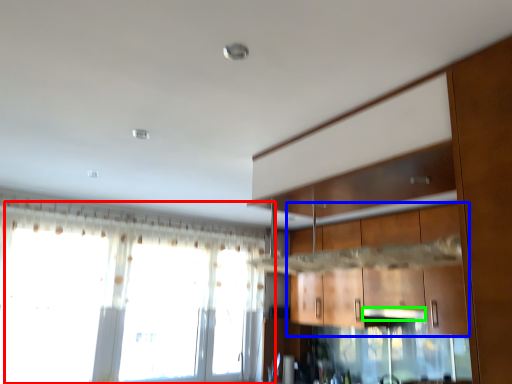
Question: Which object is positioned closest to window (highlighted by a red box)? Select from cabinetry (highlighted by a blue box) and exhaust hood (highlighted by a green box).

Choices:
 (A) cabinetry
 (B) exhaust hood

Answer: (A)